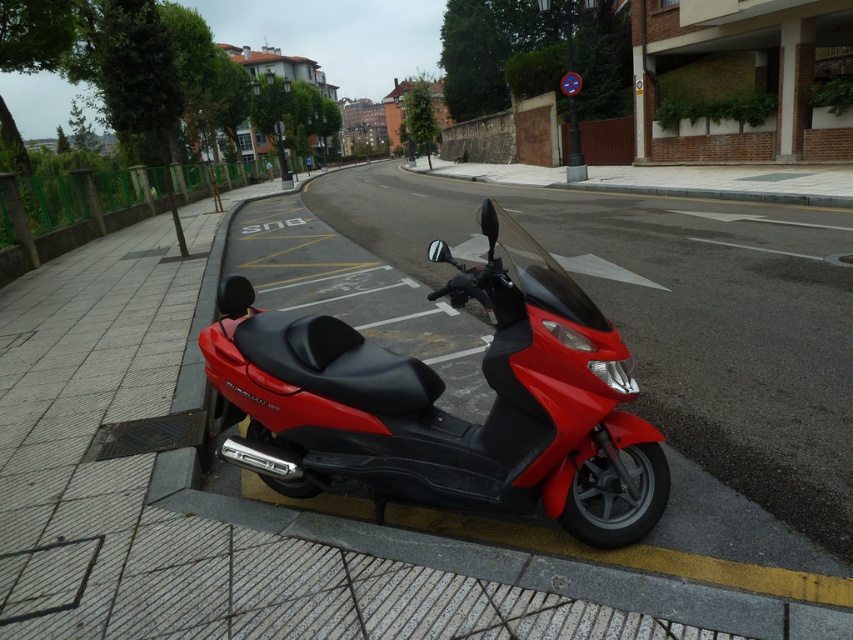
Question: Does matte black pavement at center come behind matte red scooter at center?

Choices:
 (A) yes
 (B) no

Answer: (B)

Question: Is matte black pavement at center wider than matte red scooter at center?

Choices:
 (A) yes
 (B) no

Answer: (A)

Question: Which object appears closest to the camera in this image?

Choices:
 (A) matte black pavement at center
 (B) matte red scooter at center

Answer: (A)

Question: Which object is farther from the camera taking this photo?

Choices:
 (A) matte black pavement at center
 (B) matte red scooter at center

Answer: (B)

Question: Can you confirm if matte black pavement at center is positioned below matte red scooter at center?

Choices:
 (A) yes
 (B) no

Answer: (B)